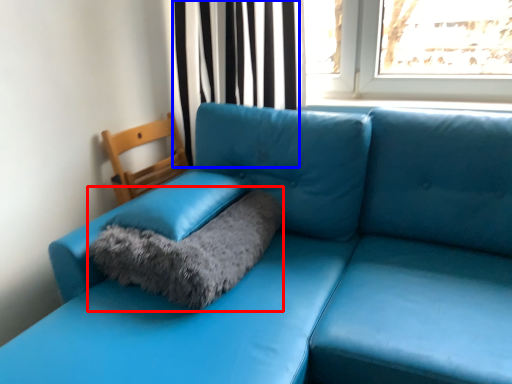
Question: Among these objects, which one is nearest to the camera, cat bed (highlighted by a red box) or curtain (highlighted by a blue box)?

Choices:
 (A) cat bed
 (B) curtain

Answer: (A)